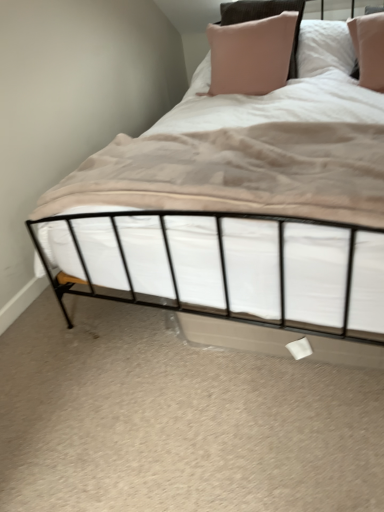
The width and height of the screenshot is (384, 512). What are the coordinates of `pink fabric pillow at upper center` in the screenshot? It's located at (251, 55).

Image resolution: width=384 pixels, height=512 pixels. What do you see at coordinates (251, 55) in the screenshot? I see `pink fabric pillow at upper center` at bounding box center [251, 55].

What is the approximate width of pink fabric pillow at upper center?

pink fabric pillow at upper center is 36.11 centimeters in width.

This screenshot has height=512, width=384. I want to click on beige soft fabric at center, so click(x=246, y=156).

Describe the element at coordinates (246, 156) in the screenshot. I see `beige soft fabric at center` at that location.

The image size is (384, 512). What are the coordinates of `pink fabric pillow at upper center` in the screenshot? It's located at (251, 55).

Is pink fabric pillow at upper center at the left side of beige soft fabric at center?

In fact, pink fabric pillow at upper center is to the right of beige soft fabric at center.

Which object is closer to the camera taking this photo, pink fabric pillow at upper center or beige soft fabric at center?

Positioned in front is beige soft fabric at center.

Which is in front, point (238, 33) or point (330, 155)?

Positioned in front is point (330, 155).

From the image's perspective, which object appears higher, pink fabric pillow at upper center or beige soft fabric at center?

pink fabric pillow at upper center, from the image's perspective.

From a real-world perspective, is pink fabric pillow at upper center over beige soft fabric at center?

Yes, from a real-world perspective, pink fabric pillow at upper center is above beige soft fabric at center.

Considering the sizes of objects pink fabric pillow at upper center and beige soft fabric at center in the image provided, who is thinner, pink fabric pillow at upper center or beige soft fabric at center?

With smaller width is pink fabric pillow at upper center.

Which of these two, pink fabric pillow at upper center or beige soft fabric at center, stands taller?

pink fabric pillow at upper center.

Who is bigger, pink fabric pillow at upper center or beige soft fabric at center?

With larger size is pink fabric pillow at upper center.

Is pink fabric pillow at upper center inside the boundaries of beige soft fabric at center, or outside?

pink fabric pillow at upper center is spatially situated outside beige soft fabric at center.

Is pink fabric pillow at upper center not near beige soft fabric at center?

No.

Could you tell me if pink fabric pillow at upper center is turned towards beige soft fabric at center?

Yes, pink fabric pillow at upper center faces towards beige soft fabric at center.

This screenshot has width=384, height=512. In order to click on sheet below the pink fabric pillow at upper center (from the image's perspective) in this screenshot , I will do `click(246, 156)`.

Which is more to the right, beige soft fabric at center or pink fabric pillow at upper center?

pink fabric pillow at upper center.

Does beige soft fabric at center come in front of pink fabric pillow at upper center?

Yes, it is.

Which is farther from the camera, (224,151) or (216,64)?

The point (216,64) is behind.

From the image's perspective, is beige soft fabric at center located above or below pink fabric pillow at upper center?

From the image's perspective, beige soft fabric at center appears below pink fabric pillow at upper center.

From a real-world perspective, which object stands above the other?

From a 3D spatial view, pink fabric pillow at upper center is above.

In the scene shown: Which object is wider, beige soft fabric at center or pink fabric pillow at upper center?

beige soft fabric at center is wider.

Considering the sizes of beige soft fabric at center and pink fabric pillow at upper center in the image, is beige soft fabric at center taller or shorter than pink fabric pillow at upper center?

beige soft fabric at center is shorter than pink fabric pillow at upper center.

Which of these two, beige soft fabric at center or pink fabric pillow at upper center, is bigger?

pink fabric pillow at upper center is bigger.

Is beige soft fabric at center outside of pink fabric pillow at upper center?

That's correct, beige soft fabric at center is outside of pink fabric pillow at upper center.

Are beige soft fabric at center and pink fabric pillow at upper center making contact?

No, beige soft fabric at center is not making contact with pink fabric pillow at upper center.

Is beige soft fabric at center facing towards pink fabric pillow at upper center?

No, beige soft fabric at center is not turned towards pink fabric pillow at upper center.

In the scene shown: Can you tell me how much beige soft fabric at center and pink fabric pillow at upper center differ in facing direction?

The angular difference between beige soft fabric at center and pink fabric pillow at upper center is 2.05 degrees.

The height and width of the screenshot is (512, 384). What are the coordinates of `pillow above the beige soft fabric at center (from a real-world perspective)` in the screenshot? It's located at (251, 55).

The width and height of the screenshot is (384, 512). Identify the location of sheet on the left of the pink fabric pillow at upper center. (246, 156).

You are a GUI agent. You are given a task and a screenshot of the screen. Output one action in this format:
    pyautogui.click(x=<x>, y=<y>)
    Task: Click on the pillow that is above the beige soft fabric at center (from the image's perspective)
    The height and width of the screenshot is (512, 384).
    Given the screenshot: What is the action you would take?
    pyautogui.click(x=251, y=55)